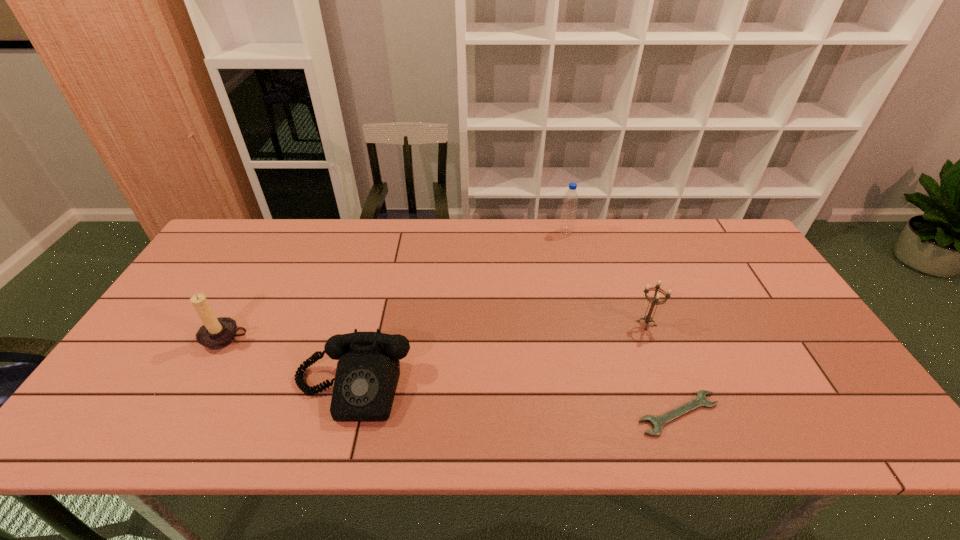
The width and height of the screenshot is (960, 540). I want to click on vacant area that lies between the shortest object and the telephone, so click(515, 401).

I want to click on object that is the second closest to the right candle holder, so click(x=569, y=207).

This screenshot has width=960, height=540. Find the location of `object that stands as the fourth closest to the second object from left to right`. object that stands as the fourth closest to the second object from left to right is located at coordinates (569, 207).

Where is `vacant area that satisfies the following two spatial constraints: 1. on the wick of the wrench; 2. on the left side of the taller candle holder`? The width and height of the screenshot is (960, 540). vacant area that satisfies the following two spatial constraints: 1. on the wick of the wrench; 2. on the left side of the taller candle holder is located at coordinates (185, 414).

At what (x,y) coordinates should I click in order to perform the action: click on vacant space that satisfies the following two spatial constraints: 1. on the back side of the wrench; 2. on the right side of the right candle holder. Please return your answer as a coordinate pair (x, y). This screenshot has width=960, height=540. Looking at the image, I should click on (645, 323).

Identify the location of vacant region that satisfies the following two spatial constraints: 1. on the wick of the wrench; 2. on the right side of the fourth shortest object. (185, 414).

Locate an element on the screen. This screenshot has width=960, height=540. free space that satisfies the following two spatial constraints: 1. on the dial of the second object from left to right; 2. on the right side of the shortest object is located at coordinates (346, 414).

At what (x,y) coordinates should I click in order to perform the action: click on vacant space that satisfies the following two spatial constraints: 1. on the wick of the left candle holder; 2. on the right side of the shortest object. Please return your answer as a coordinate pair (x, y). Looking at the image, I should click on pos(185,414).